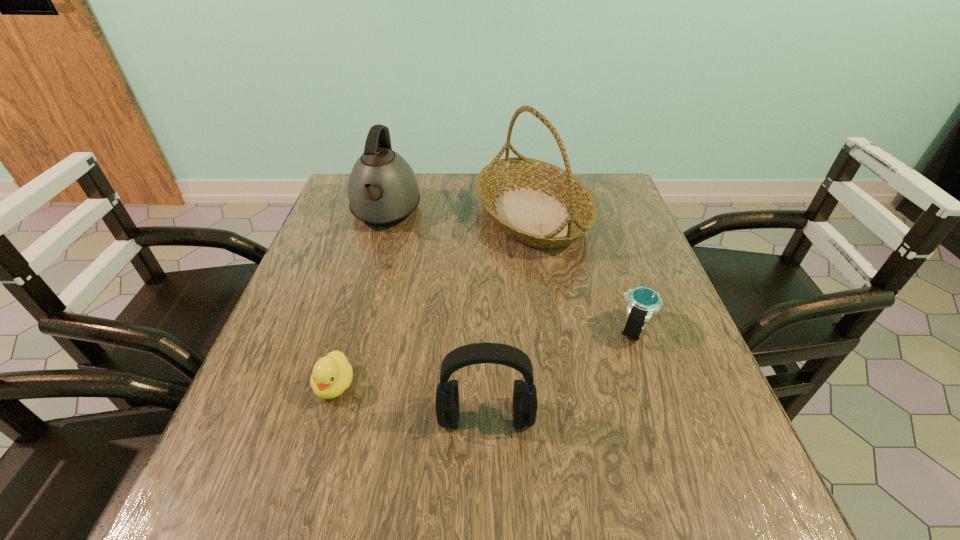
Locate an element on the screen. The height and width of the screenshot is (540, 960). basket that is positioned at the far edge is located at coordinates (534, 202).

The image size is (960, 540). I want to click on kettle present at the far edge, so click(382, 189).

Image resolution: width=960 pixels, height=540 pixels. What are the coordinates of `kettle positioned at the left edge` in the screenshot? It's located at (382, 189).

I want to click on duckling at the left edge, so click(332, 375).

You are a GUI agent. You are given a task and a screenshot of the screen. Output one action in this format:
    pyautogui.click(x=<x>, y=<y>)
    Task: Click on the basket that is positioned at the right edge
    This screenshot has width=960, height=540.
    Given the screenshot: What is the action you would take?
    pyautogui.click(x=534, y=202)

Identify the location of watch located at the right edge. (642, 302).

Locate an element on the screen. This screenshot has width=960, height=540. object located in the far left corner section of the desktop is located at coordinates (382, 189).

You are a GUI agent. You are given a task and a screenshot of the screen. Output one action in this format:
    pyautogui.click(x=<x>, y=<y>)
    Task: Click on the object that is at the far right corner
    Image resolution: width=960 pixels, height=540 pixels.
    Given the screenshot: What is the action you would take?
    pyautogui.click(x=534, y=202)

At what (x,y) coordinates should I click in order to perform the action: click on vacant space at the far edge of the desktop. Please return your answer as a coordinate pair (x, y). Looking at the image, I should click on (444, 192).

Identify the location of vacant region at the near edge of the desktop. (562, 505).